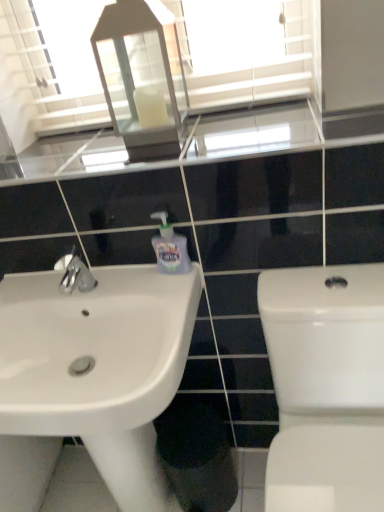
Image resolution: width=384 pixels, height=512 pixels. I want to click on free location in front of white glass lantern at upper center, so click(164, 150).